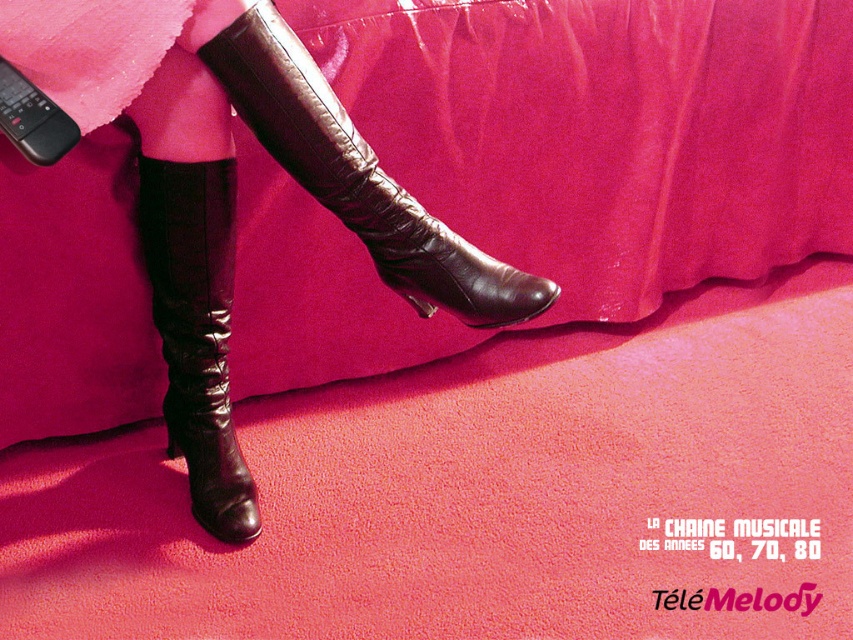
Question: Can you confirm if shiny brown leather boot at center is smaller than shiny black boot at lower left?

Choices:
 (A) no
 (B) yes

Answer: (A)

Question: Does shiny brown leather boot at center appear on the right side of shiny black boot at lower left?

Choices:
 (A) yes
 (B) no

Answer: (A)

Question: Based on their relative distances, which object is farther from the shiny brown leather boot at center?

Choices:
 (A) shiny black boot at lower left
 (B) velvet pink skirt at upper center

Answer: (B)

Question: From the image, what is the correct spatial relationship of velvet pink skirt at upper center in relation to shiny black boot at lower left?

Choices:
 (A) left
 (B) right

Answer: (B)

Question: Among these objects, which one is nearest to the camera?

Choices:
 (A) shiny brown leather boot at center
 (B) velvet pink skirt at upper center
 (C) shiny black boot at lower left

Answer: (A)

Question: Which point is farther from the camera taking this photo?

Choices:
 (A) (200, 381)
 (B) (564, 260)

Answer: (B)